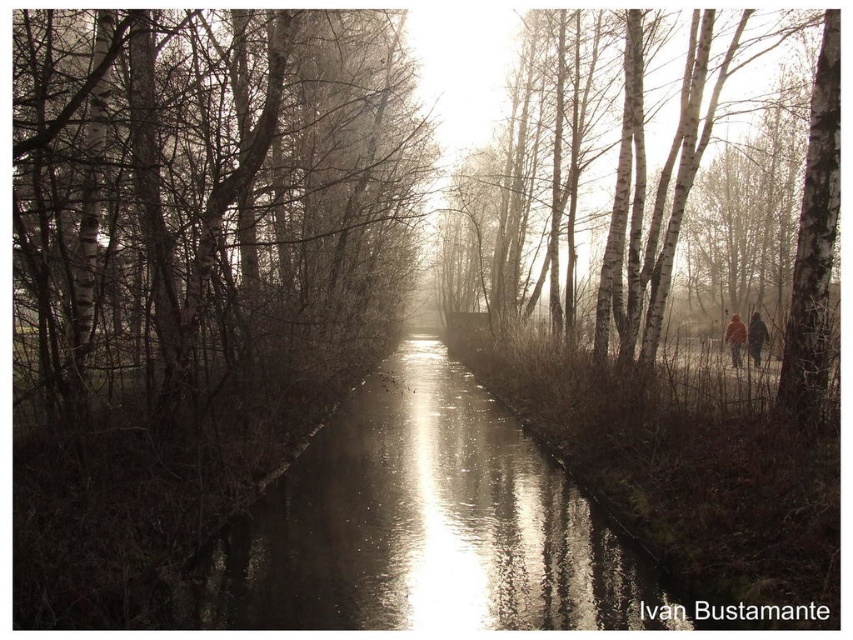
In the scene shown: You are a kayaker preparing to paddle down the waterway shown in the image. You need to know the position of the glistening reflective water at center relative to the white bark trees at center to navigate safely. Can you tell me which one is on the left side from your perspective?

The glistening reflective water at center is positioned on the left side of white bark trees at center, so from your perspective as a kayaker facing the direction of the waterway, the glistening reflective water at center would be on your left side.

You are a photographer aiming to capture the entire scene in one shot. Given that your camera can only focus on objects within a 10m width, and the smooth bark trees at center and glistening reflective water at center are the main subjects, will both fit within the camera frame?

The smooth bark trees at center is bigger than glistening reflective water at center, so both can fit within the 10m width frame as their combined size may not exceed it.

You are a kayaker approaching the center of the waterway. You see the smooth bark trees at center and the glistening reflective water at center. Which object will you encounter first?

The smooth bark trees at center are in front of the glistening reflective water at center, so you will encounter the smooth bark trees at center first.